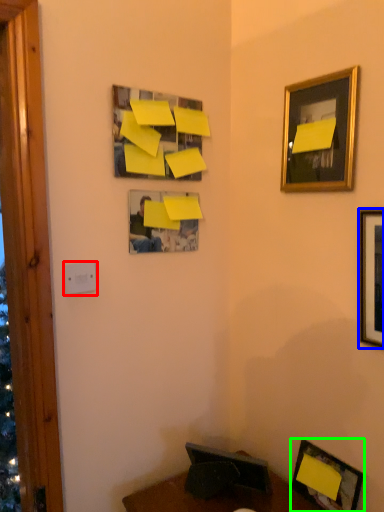
Question: Based on their relative distances, which object is farther from light switch (highlighted by a red box)? Choose from picture frame (highlighted by a blue box) and picture frame (highlighted by a green box).

Choices:
 (A) picture frame
 (B) picture frame

Answer: (B)